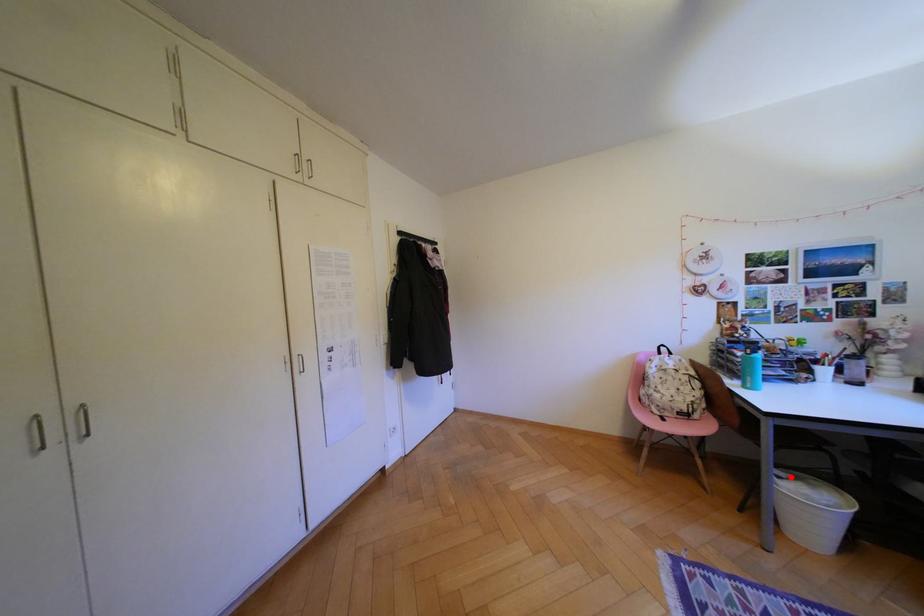
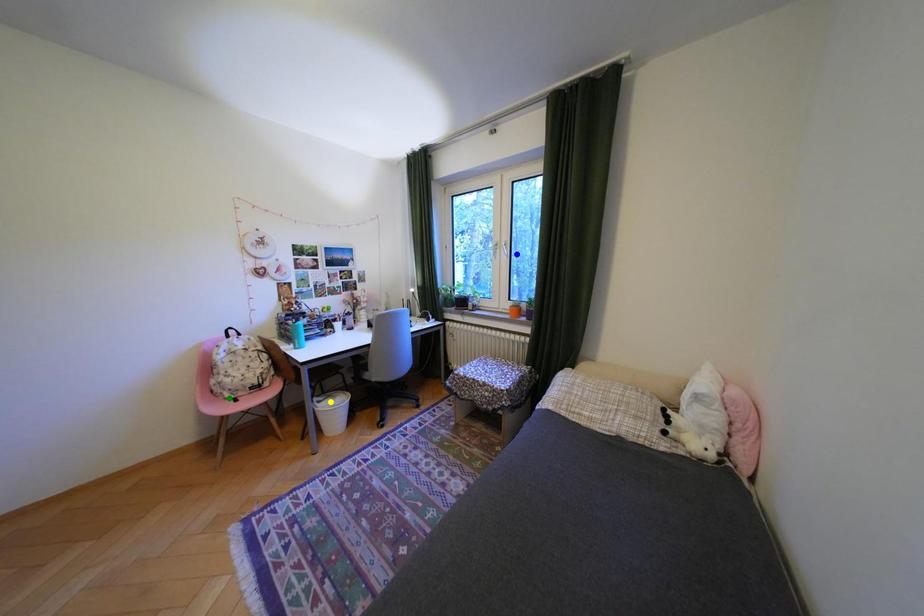
Question: I am providing you with two images of the same scene from different viewpoints. A red point is marked on the first image. You are given multiple points on the second image. Which spot in image 2 lines up with the point in image 1?

Choices:
 (A) green point
 (B) yellow point
 (C) blue point

Answer: (B)